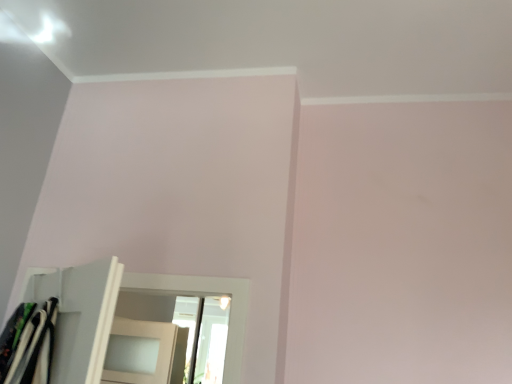
Where is `transparent glass door at center`? transparent glass door at center is located at coordinates (203, 337).

What do you see at coordinates (203, 337) in the screenshot?
I see `transparent glass door at center` at bounding box center [203, 337].

The width and height of the screenshot is (512, 384). I want to click on transparent glass door at center, so click(203, 337).